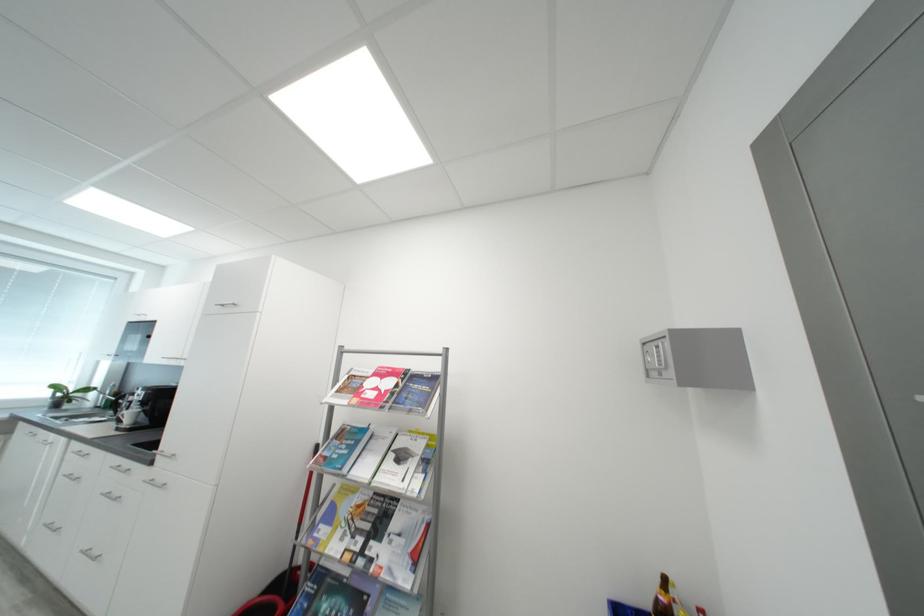
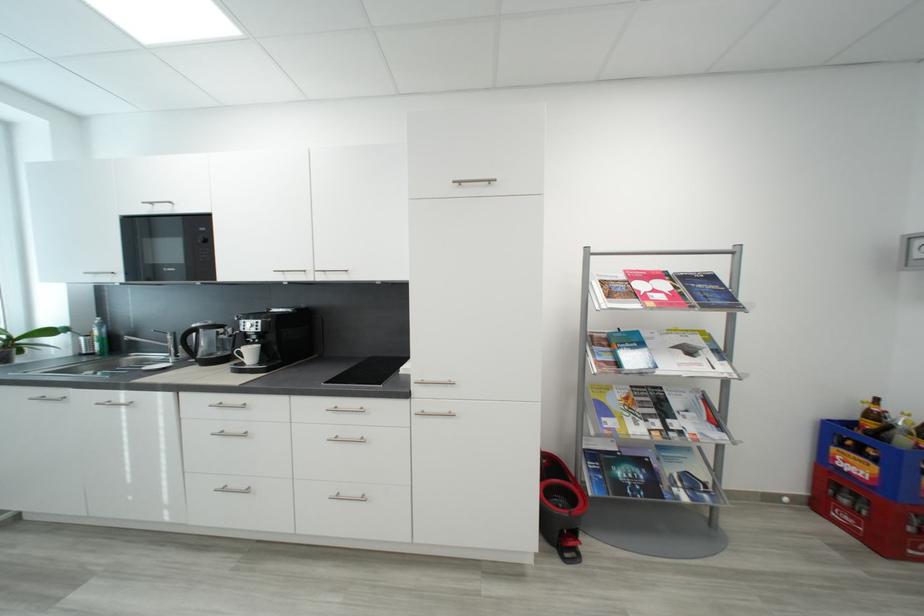
Locate, in the second image, the point that corresponds to pixel 403 525 in the first image.

(684, 406)